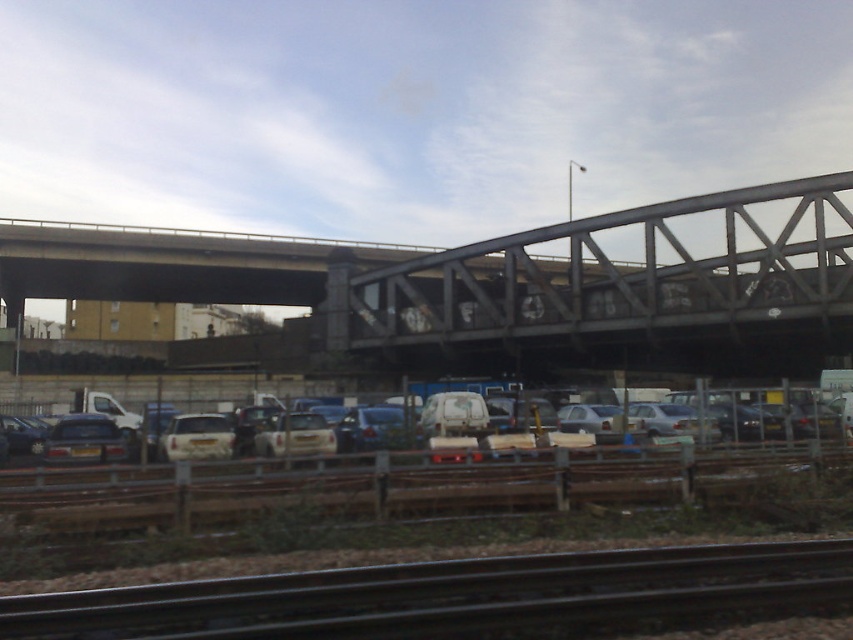
Question: Considering the real-world distances, which object is closest to the metallic gray bridge at upper center?

Choices:
 (A) silver metallic van at center
 (B) silver metallic car at center
 (C) white matte van at center

Answer: (C)

Question: Which of the following is the farthest from the observer?

Choices:
 (A) silver metallic car at center
 (B) white matte van at center
 (C) silver metallic van at center
 (D) matte black car at left

Answer: (A)

Question: Considering the relative positions of metal at bottom and matte black car at left in the image provided, where is metal at bottom located with respect to matte black car at left?

Choices:
 (A) above
 (B) below

Answer: (A)

Question: Is metal at bottom to the left of silver metallic car at center from the viewer's perspective?

Choices:
 (A) no
 (B) yes

Answer: (A)

Question: Is white matte van at center to the right of matte black car at left from the viewer's perspective?

Choices:
 (A) yes
 (B) no

Answer: (A)

Question: Which point is farther to the camera?

Choices:
 (A) metallic gray bridge at upper center
 (B) white matte van at center
 (C) metal at bottom

Answer: (A)